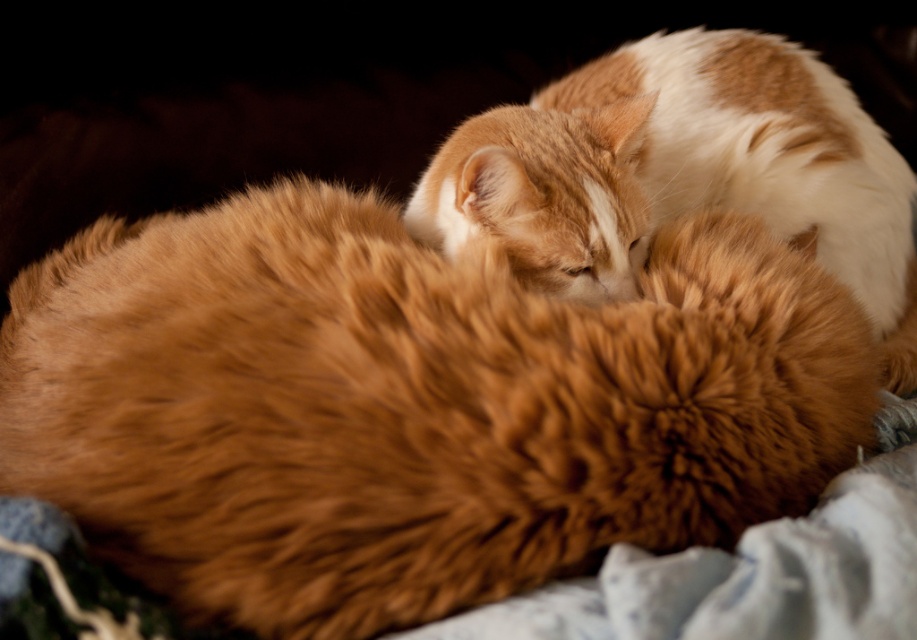
You are a photographer trying to capture a close shot of the cats. Which cat is positioned lower in the frame, the fluffy orange cat at center or the orange fur cat at upper right?

The fluffy orange cat at center is positioned lower in the frame than the orange fur cat at upper right.

You are a photographer holding a camera with a 12 inch long lens. You want to take a close up photo of the fluffy orange cat at center. Can you get close enough to take the photo without moving the cat?

The distance between the fluffy orange cat at center and the viewer is 16.50 inches. Since the lens is 12 inches long, you can get close enough to take the photo without moving the cat because the distance is greater than the lens length.

You are a photographer trying to capture a portrait of both cats. Since the fluffy orange cat at center is shorter than the orange fur cat at upper right, which cat should you adjust the camera focus to ensure both are in focus?

The fluffy orange cat at center is shorter than the orange fur cat at upper right. To ensure both are in focus, adjust the camera focus to the orange fur cat at upper right since it is taller and farther away from the camera.